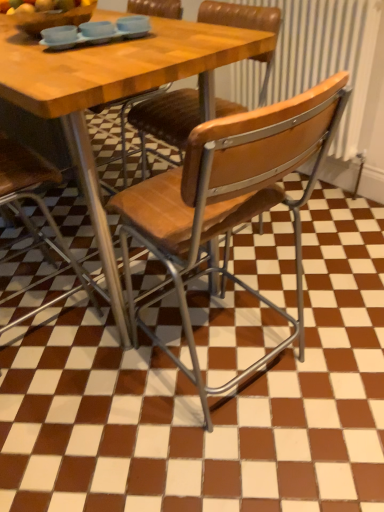
At what (x,y) coordinates should I click in order to perform the action: click on free point to the right of wooden seat at center, positioned as the second chair in right-to-left order. Please return your answer as a coordinate pair (x, y). This screenshot has width=384, height=512. Looking at the image, I should click on (314, 236).